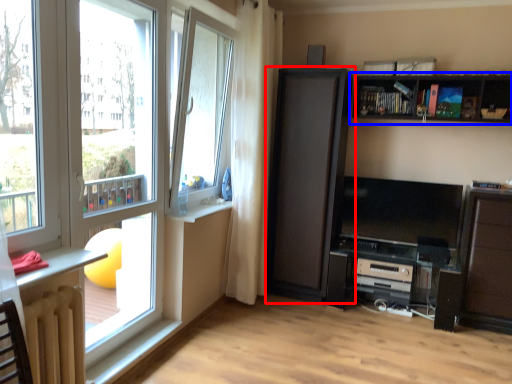
Question: Which of the following is the closest to the observer, cupboard (highlighted by a red box) or shelf (highlighted by a blue box)?

Choices:
 (A) cupboard
 (B) shelf

Answer: (B)